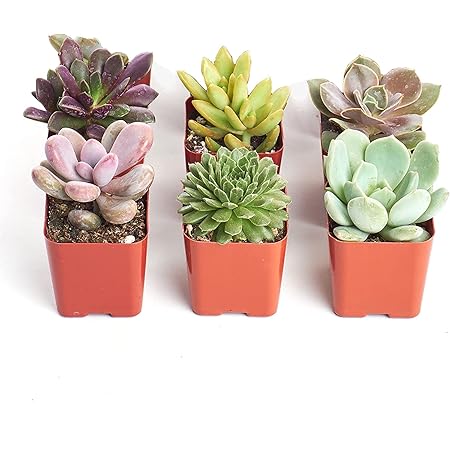
Locate an element on the screen. Image resolution: width=450 pixels, height=450 pixels. shadow of plant on white flooring is located at coordinates (312, 209).